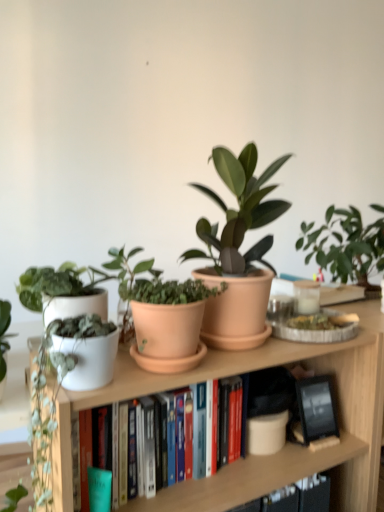
Image resolution: width=384 pixels, height=512 pixels. I want to click on empty space that is to the right of terracotta clay pot at center, the second houseplant in the left-to-right sequence, so click(x=248, y=353).